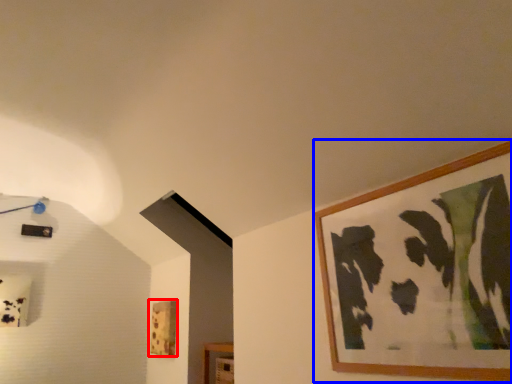
Question: Among these objects, which one is nearest to the camera, picture frame (highlighted by a red box) or picture frame (highlighted by a blue box)?

Choices:
 (A) picture frame
 (B) picture frame

Answer: (B)